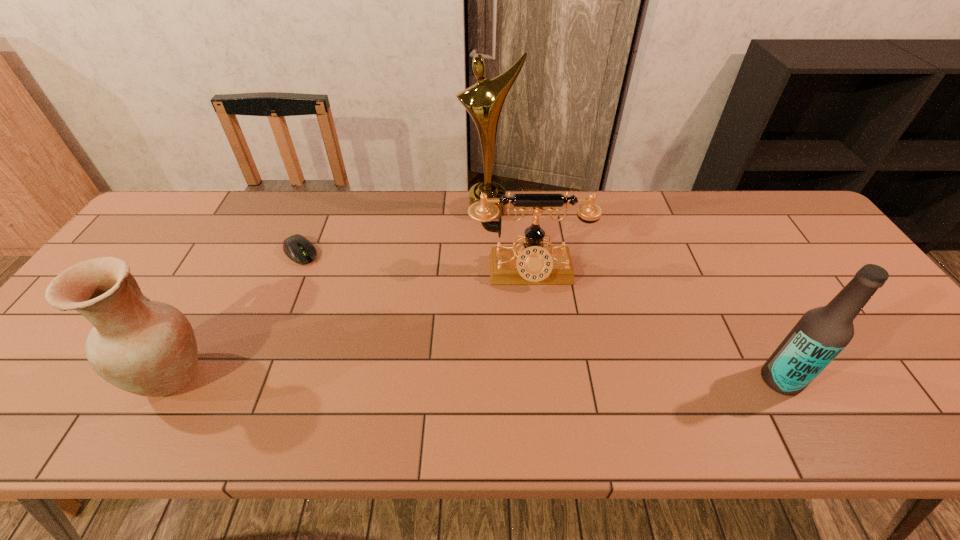
This screenshot has height=540, width=960. I want to click on vacant space situated 0.380m on the side of the rightmost object with the label, so click(x=591, y=380).

Where is `free space located on the wheel side of the computer mouse`? The image size is (960, 540). free space located on the wheel side of the computer mouse is located at coordinates (318, 272).

Find the location of a particular element. The height and width of the screenshot is (540, 960). vacant space located 0.050m on the wheel side of the computer mouse is located at coordinates (318, 272).

At what (x,y) coordinates should I click in order to perform the action: click on free region located 0.360m on the wheel side of the computer mouse. Please return your answer as a coordinate pair (x, y). The width and height of the screenshot is (960, 540). Looking at the image, I should click on (380, 340).

I want to click on free region located 0.250m on the front-facing side of the award, so click(487, 279).

Locate an element on the screen. This screenshot has width=960, height=540. free point located on the front-facing side of the award is located at coordinates (488, 261).

Where is `vacant space located 0.150m on the front-facing side of the award`? The image size is (960, 540). vacant space located 0.150m on the front-facing side of the award is located at coordinates (488, 254).

In order to click on vacant space located on the dial of the fourth tallest object in this screenshot , I will do `click(534, 316)`.

This screenshot has height=540, width=960. I want to click on free space located 0.100m on the dial of the fourth tallest object, so click(x=535, y=322).

Identify the location of free point located on the dial of the fourth tallest object. Image resolution: width=960 pixels, height=540 pixels. (541, 379).